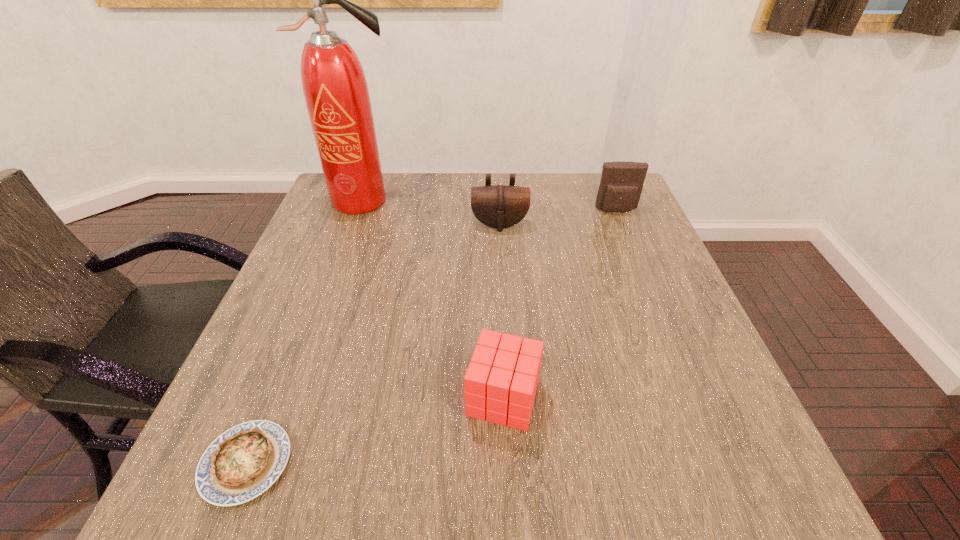
Locate an element on the screen. The image size is (960, 540). free point located 0.160m on the right of the cube is located at coordinates (632, 397).

Locate an element on the screen. Image resolution: width=960 pixels, height=540 pixels. free space located 0.360m on the back of the shortest object is located at coordinates (320, 279).

The image size is (960, 540). Find the location of `fire extinguisher present at the far edge`. fire extinguisher present at the far edge is located at coordinates (336, 93).

Where is `object that is at the near edge`? The width and height of the screenshot is (960, 540). object that is at the near edge is located at coordinates (243, 462).

At what (x,y) coordinates should I click in order to perform the action: click on fire extinguisher positioned at the left edge. Please return your answer as a coordinate pair (x, y). Looking at the image, I should click on (336, 93).

Locate an element on the screen. The image size is (960, 540). quiche that is at the left edge is located at coordinates (243, 462).

At what (x,y) coordinates should I click in order to perform the action: click on object that is at the right edge. Please return your answer as a coordinate pair (x, y). This screenshot has height=540, width=960. Looking at the image, I should click on (621, 184).

This screenshot has width=960, height=540. In order to click on object situated at the far left corner in this screenshot , I will do `click(336, 93)`.

Find the location of a particular element. The image size is (960, 540). object present at the near left corner is located at coordinates (243, 462).

Where is `object that is at the far right corner`? This screenshot has width=960, height=540. object that is at the far right corner is located at coordinates (621, 184).